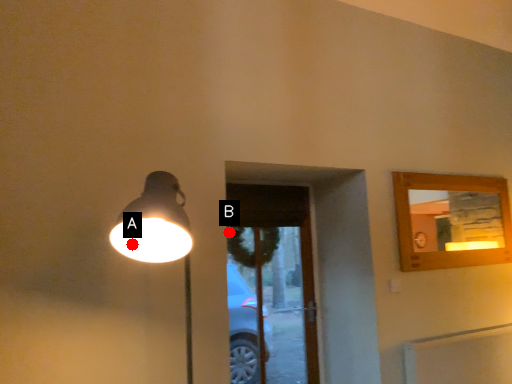
Question: Two points are circled on the image, labeled by A and B beside each circle. Which point is farther from the camera taking this photo?

Choices:
 (A) A is further
 (B) B is further

Answer: (B)